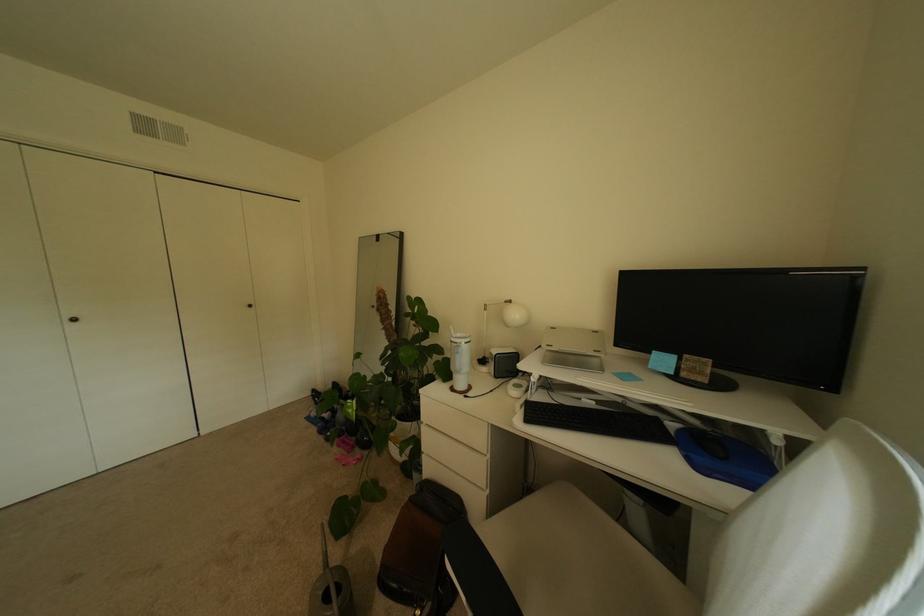
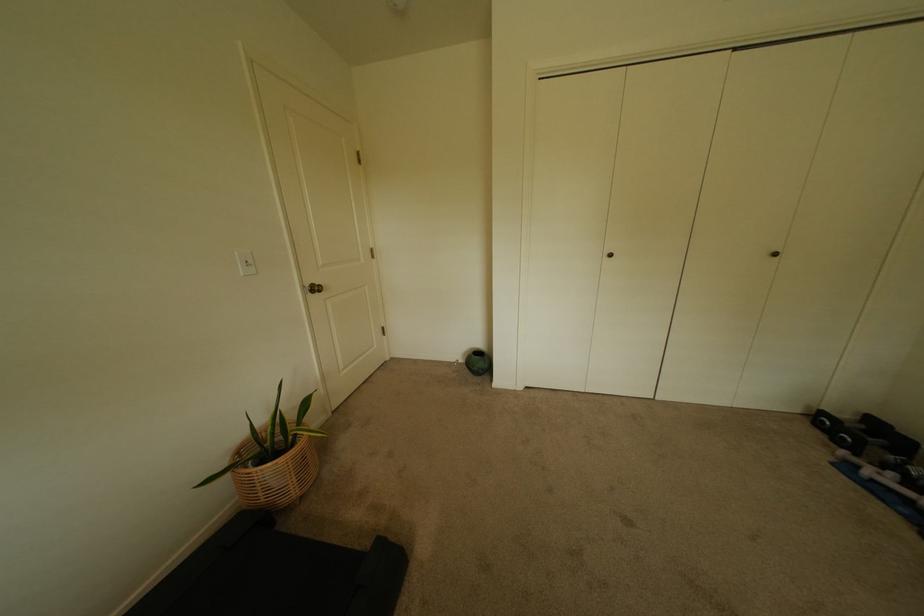
Where in the second image is the point corresponding to (259,307) from the first image?

(784, 256)